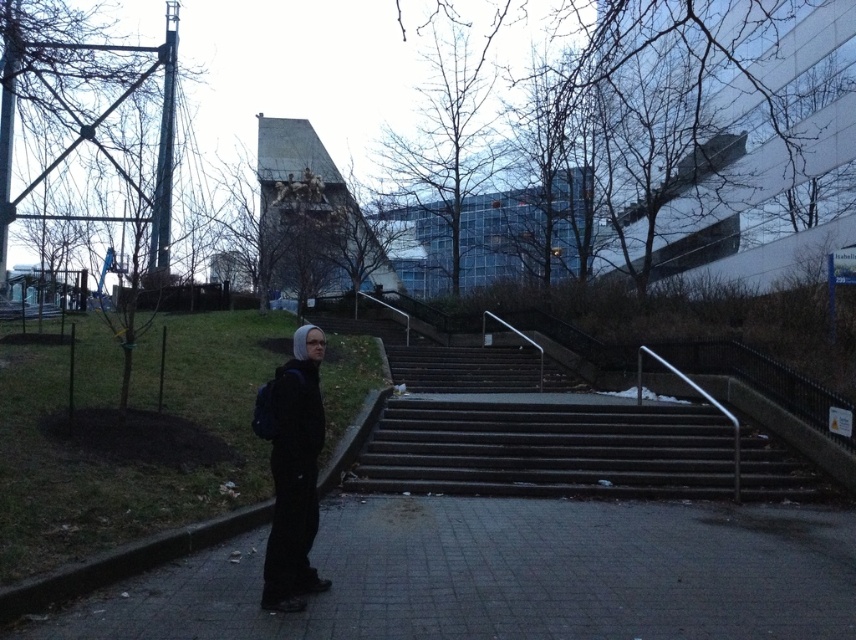
Question: Which point is closer to the camera taking this photo?

Choices:
 (A) (229, 566)
 (B) (423, 484)
 (C) (286, 536)

Answer: (C)

Question: Which of these objects is positioned closest to the dark gray concrete pavement at lower center?

Choices:
 (A) black matte clothing at center
 (B) dark gray concrete stairs at center

Answer: (A)

Question: Which of the following is the closest to the observer?

Choices:
 (A) (526, 522)
 (B) (444, 451)
 (C) (322, 416)

Answer: (C)

Question: In this image, where is dark gray concrete pavement at lower center located relative to dark gray concrete stairs at center?

Choices:
 (A) above
 (B) below

Answer: (B)

Question: Can you confirm if dark gray concrete pavement at lower center is wider than black matte clothing at center?

Choices:
 (A) yes
 (B) no

Answer: (A)

Question: Does dark gray concrete stairs at center appear on the left side of black matte clothing at center?

Choices:
 (A) yes
 (B) no

Answer: (B)